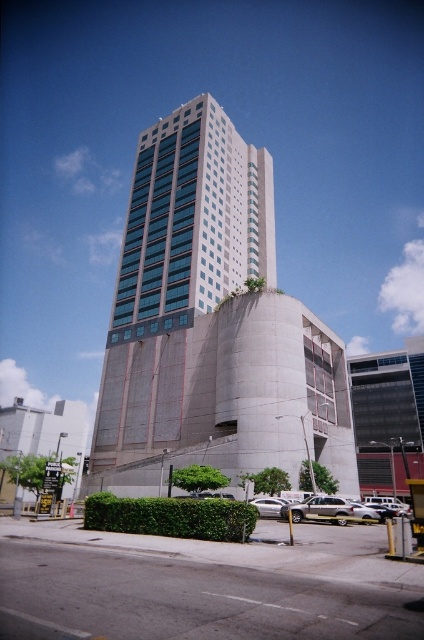
Question: Considering the relative positions of green leafy hedge at lower center and matte concrete building at lower left in the image provided, where is green leafy hedge at lower center located with respect to matte concrete building at lower left?

Choices:
 (A) below
 (B) above

Answer: (B)

Question: Which object is positioned closest to the green leafy hedge at lower center?

Choices:
 (A) matte concrete building at lower left
 (B) concrete building at center

Answer: (A)

Question: Is concrete building at center closer to camera compared to green leafy hedge at lower center?

Choices:
 (A) yes
 (B) no

Answer: (B)

Question: Among these objects, which one is farthest from the camera?

Choices:
 (A) matte concrete building at lower left
 (B) concrete building at center
 (C) green leafy hedge at lower center

Answer: (B)

Question: Where is concrete building at center located in relation to matte concrete building at lower left in the image?

Choices:
 (A) below
 (B) above

Answer: (B)

Question: Estimate the real-world distances between objects in this image. Which object is closer to the concrete building at center?

Choices:
 (A) matte concrete building at lower left
 (B) green leafy hedge at lower center

Answer: (A)